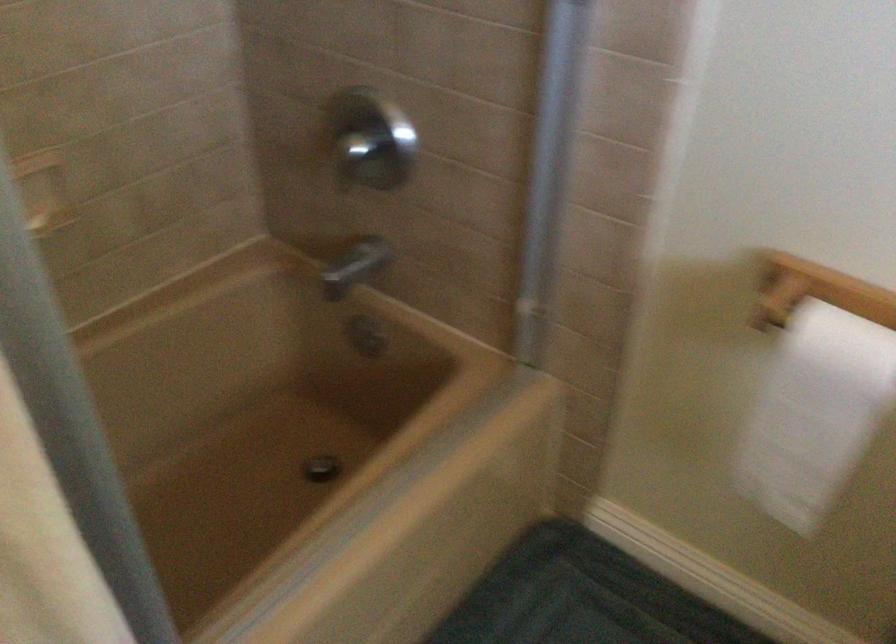
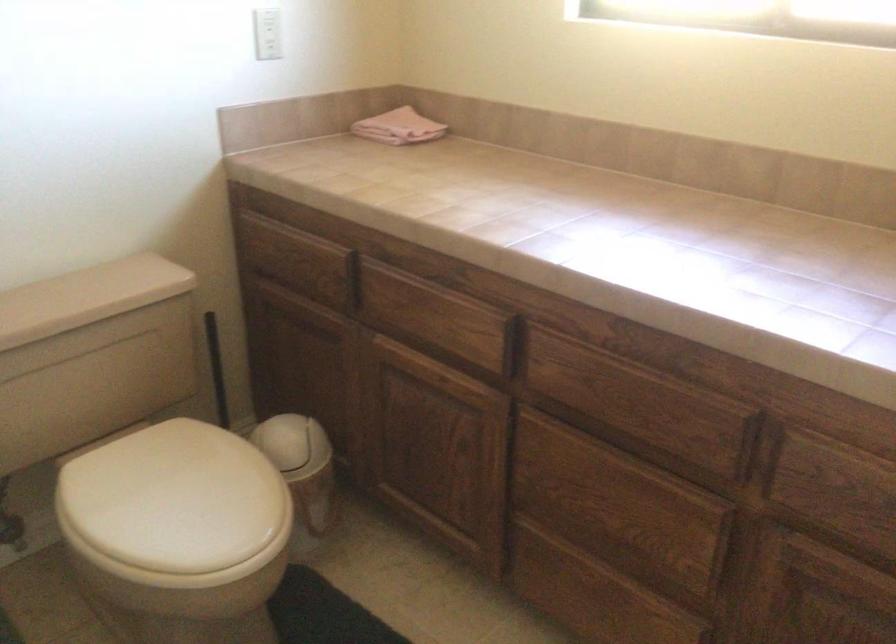
How did the camera likely rotate?

The camera rotated toward right-down.